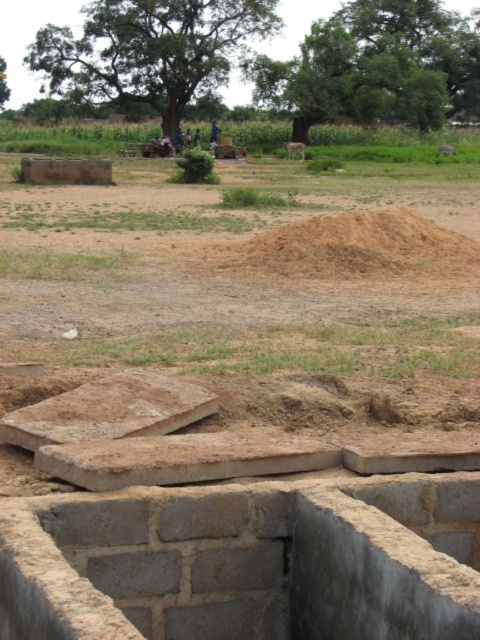
Question: Can you confirm if gray brick foundation at lower center is smaller than brown sandy mound at center?

Choices:
 (A) yes
 (B) no

Answer: (B)

Question: Among these points, which one is farthest from the camera?

Choices:
 (A) (159, 628)
 (B) (443, 230)

Answer: (B)

Question: Can you confirm if gray brick foundation at lower center is positioned below brown sandy mound at center?

Choices:
 (A) no
 (B) yes

Answer: (B)

Question: Among these points, which one is farthest from the camera?

Choices:
 (A) (322, 579)
 (B) (415, 272)

Answer: (B)

Question: Which point is closer to the camera?

Choices:
 (A) gray brick foundation at lower center
 (B) brown sandy mound at center

Answer: (A)

Question: Is gray brick foundation at lower center wider than brown sandy mound at center?

Choices:
 (A) yes
 (B) no

Answer: (A)